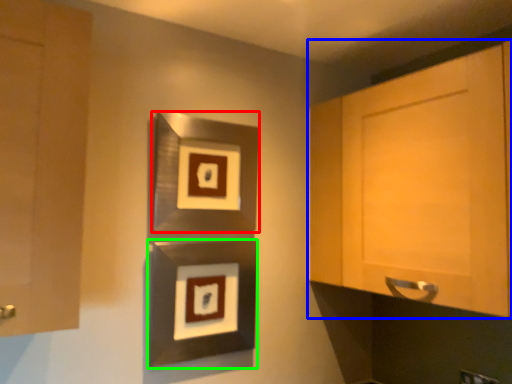
Question: Which object is the farthest from picture frame (highlighted by a red box)? Choose among these: cabinetry (highlighted by a blue box) or picture frame (highlighted by a green box).

Choices:
 (A) cabinetry
 (B) picture frame

Answer: (A)